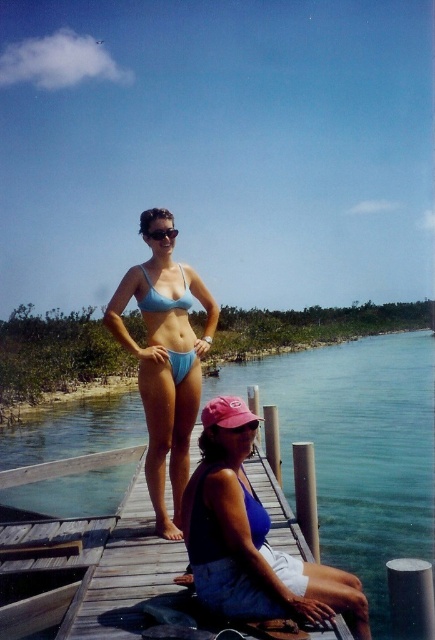
Question: Is clear blue water at center to the right of matte blue bikini at center from the viewer's perspective?

Choices:
 (A) no
 (B) yes

Answer: (B)

Question: Which point is farther from the camera taking this photo?

Choices:
 (A) (208, 541)
 (B) (150, 292)
 (C) (431, 355)

Answer: (C)

Question: Which object is closer to the camera taking this photo?

Choices:
 (A) clear blue water at center
 (B) light blue fabric bikini top at center
 (C) blue fabric bikini bottom at lower center
 (D) wooden at center

Answer: (C)

Question: Does clear blue water at center appear over blue fabric bikini bottom at lower center?

Choices:
 (A) no
 (B) yes

Answer: (A)

Question: Is blue fabric bikini bottom at lower center closer to camera compared to light blue fabric bikini at center?

Choices:
 (A) yes
 (B) no

Answer: (A)

Question: Which is farther from the matte blue bikini at center?

Choices:
 (A) light blue fabric bikini at center
 (B) light blue fabric bikini top at center
 (C) blue fabric bikini bottom at lower center
 (D) clear blue water at center

Answer: (D)